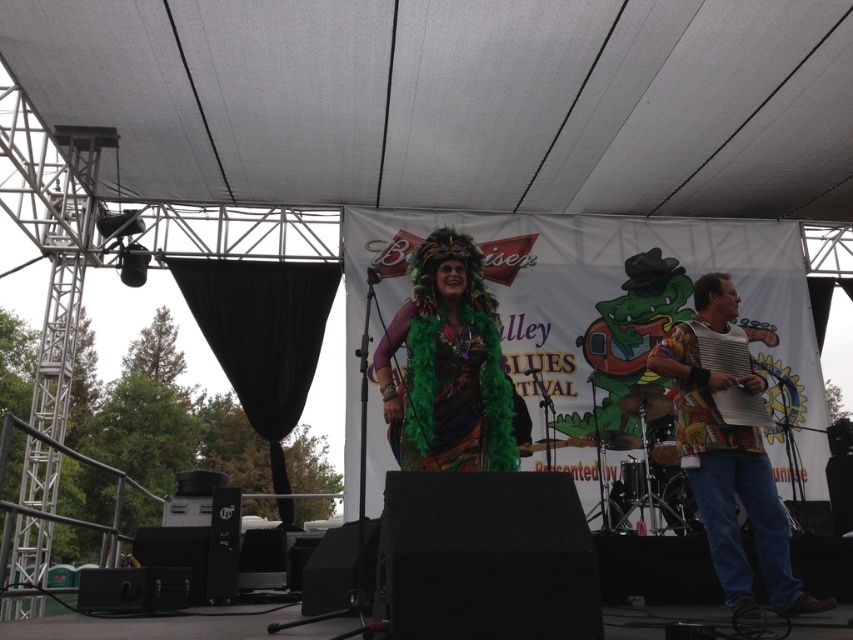
Question: Does printed fabric accordion at right appear on the left side of textured yellow accordion at center?

Choices:
 (A) no
 (B) yes

Answer: (A)

Question: Is multicolored feather boa at center closer to camera compared to textured yellow accordion at center?

Choices:
 (A) yes
 (B) no

Answer: (A)

Question: Among these points, which one is farthest from the camera?

Choices:
 (A) (813, 600)
 (B) (686, 365)

Answer: (A)

Question: Among these objects, which one is nearest to the camera?

Choices:
 (A) multicolored feather boa at center
 (B) printed fabric accordion at right

Answer: (A)

Question: Among these objects, which one is farthest from the camera?

Choices:
 (A) printed fabric accordion at right
 (B) multicolored feather boa at center
 (C) textured yellow accordion at center

Answer: (C)

Question: Is multicolored feather boa at center bigger than printed fabric accordion at right?

Choices:
 (A) yes
 (B) no

Answer: (B)